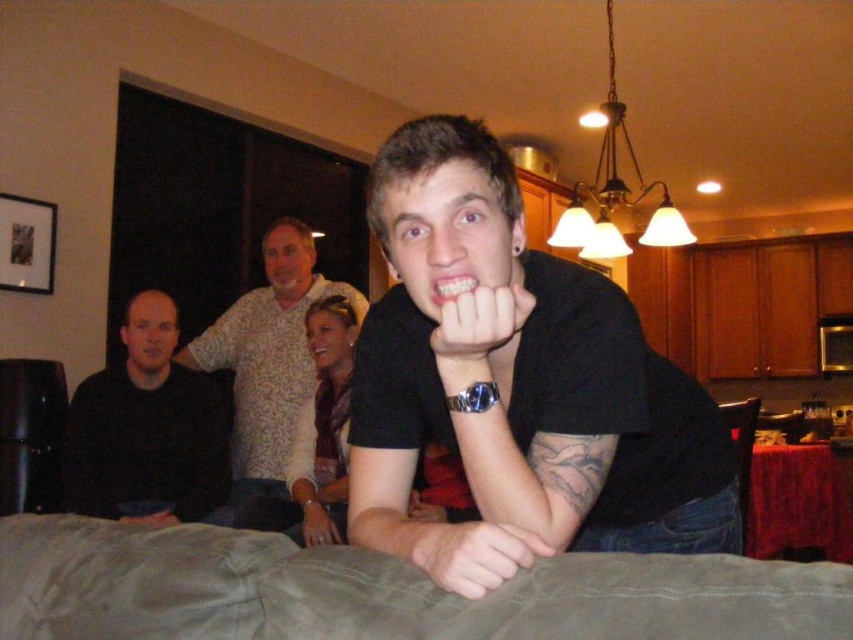
Question: Which object is positioned farthest from the black matte wristwatch at center?

Choices:
 (A) black matte shirt at center
 (B) suede-like brown bed at lower center

Answer: (B)

Question: Is the position of white matte hand at lower center more distant than that of white matte hand at center?

Choices:
 (A) no
 (B) yes

Answer: (A)

Question: Estimate the real-world distances between objects in this image. Which object is closer to the white matte hand at center?

Choices:
 (A) black matte shirt at center
 (B) matte white shirt at upper center
 (C) smooth skin hand at lower center

Answer: (A)

Question: Which object appears closest to the camera in this image?

Choices:
 (A) matte black hand at lower left
 (B) black matte shirt at left
 (C) light brown patterned shirt at center
 (D) smooth skin hand at center

Answer: (A)

Question: Does black matte shirt at left appear under white matte hand at lower center?

Choices:
 (A) no
 (B) yes

Answer: (B)

Question: Does black matte wristwatch at center have a smaller size compared to smooth skin hand at center?

Choices:
 (A) yes
 (B) no

Answer: (B)